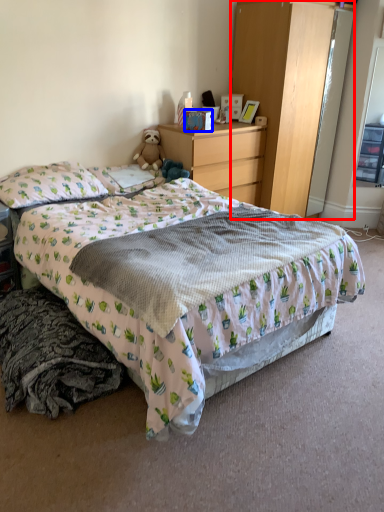
Question: Which of the following is the closest to the observer, cabinetry (highlighted by a red box) or box (highlighted by a blue box)?

Choices:
 (A) cabinetry
 (B) box

Answer: (A)